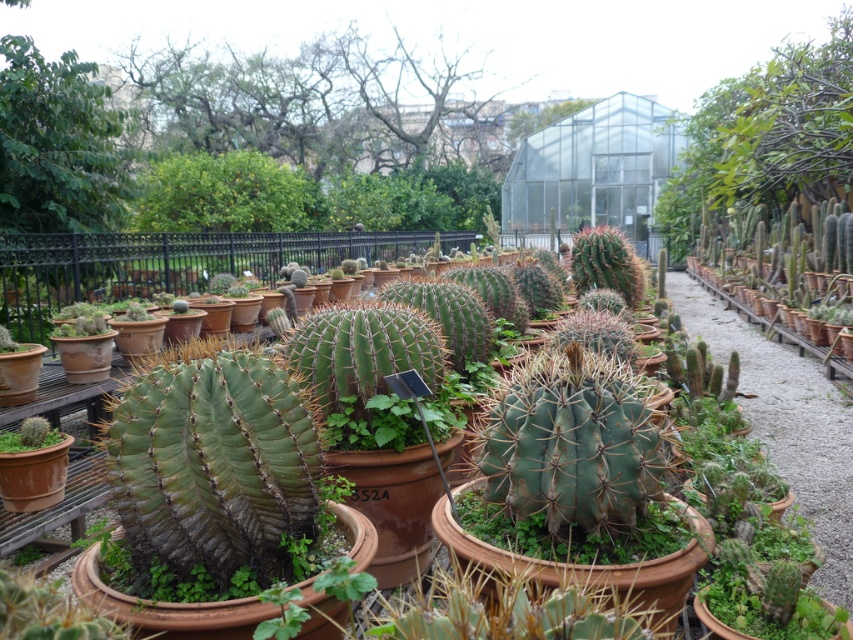
You are standing in the cactus garden and want to walk from the point at coordinates point (312, 248) to the point at coordinates point (38, 420). Which direction should you move to get closer to your destination?

To move from point (312, 248) to point (38, 420), you should move downward and to the right since point (38, 420) is located below and to the right of point (312, 248).

You are a gardener standing in the cactus garden and want to water the green matte cactus at center. If your watering can has a maximum reach of 2 meters, can you water it without moving closer?

The green matte cactus at center and the viewer are 2.73 meters apart. Since the watering can only reaches 2 meters, you cannot water it without moving closer.

You are standing in the cactus garden and want to locate the green matte cactus at lower left and the green matte cactus at center. According to the scene, which cactus is positioned higher up in the image?

The green matte cactus at center is positioned higher up because it is above the green matte cactus at lower left.